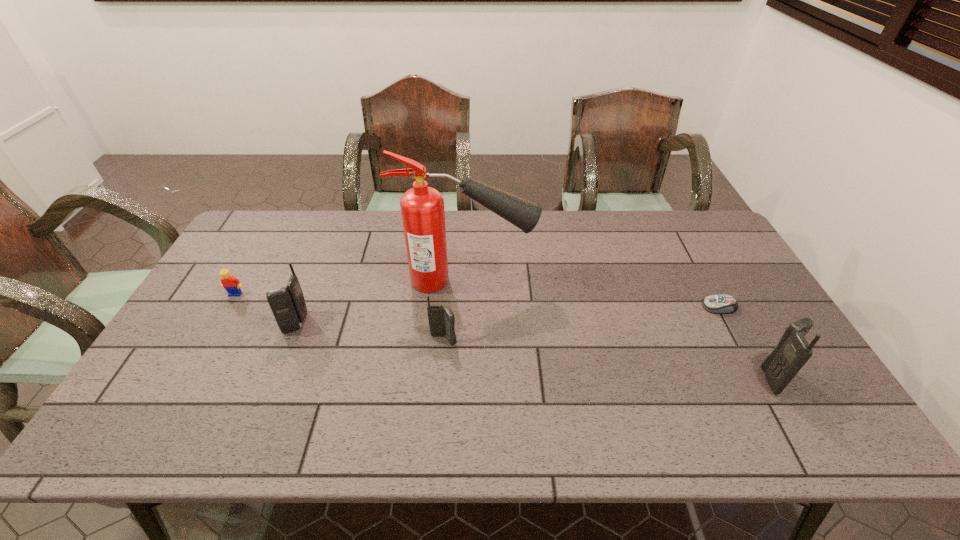
The image size is (960, 540). What are the coordinates of `free space located on the keyboard of the leftmost cellular telephone` in the screenshot? It's located at tap(206, 323).

The height and width of the screenshot is (540, 960). Identify the location of free space located 0.150m on the keyboard of the leftmost cellular telephone. (231, 323).

Where is `vacant space positioned 0.250m on the keyboard of the leftmost cellular telephone`? vacant space positioned 0.250m on the keyboard of the leftmost cellular telephone is located at coordinates (196, 323).

Locate an element on the screen. This screenshot has height=540, width=960. vacant space located 0.070m on the keyboard of the second cellular telephone from left to right is located at coordinates click(x=442, y=369).

This screenshot has height=540, width=960. I want to click on vacant region located 0.060m on the keyboard of the nearest object, so click(x=813, y=379).

Locate an element on the screen. free space located on the wheel side of the shortest object is located at coordinates (644, 307).

Where is `vacant space located 0.390m on the wheel side of the shortest object`? vacant space located 0.390m on the wheel side of the shortest object is located at coordinates (567, 307).

What are the coordinates of `free location located 0.400m on the wheel side of the shortest object` in the screenshot? It's located at (564, 307).

In order to click on free space located at the nozzle of the fire extinguisher in this screenshot , I will do `click(595, 281)`.

Identify the location of vacant space positioned on the face of the second shortest object. The image size is (960, 540). pyautogui.click(x=204, y=348).